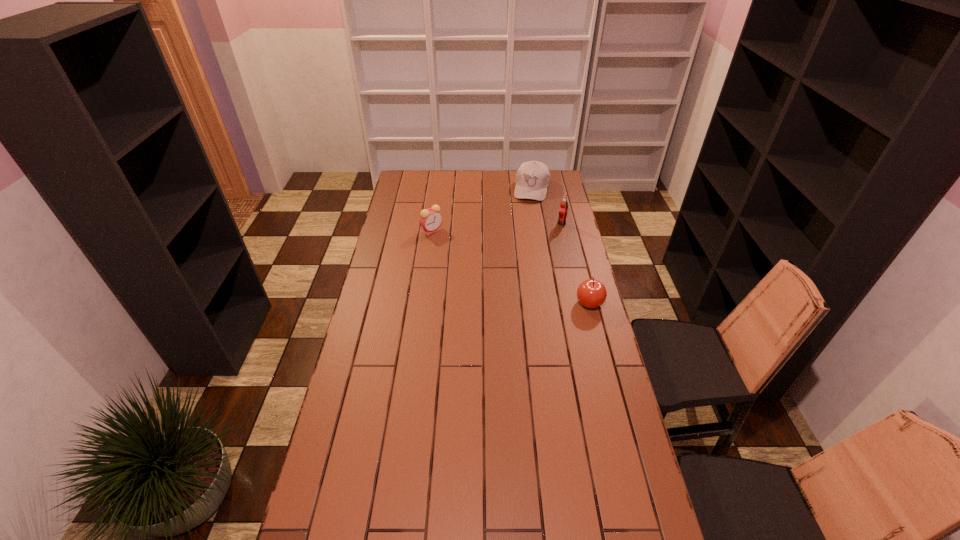
Where is `vacant space on the desktop that is between the alarm clock and the apple and is positioned on the label of the soda bottle`? vacant space on the desktop that is between the alarm clock and the apple and is positioned on the label of the soda bottle is located at coordinates (510, 266).

The width and height of the screenshot is (960, 540). Identify the location of free spot on the desktop that is between the leftmost object and the nearest object and is positioned on the front-facing side of the baseball cap. (513, 268).